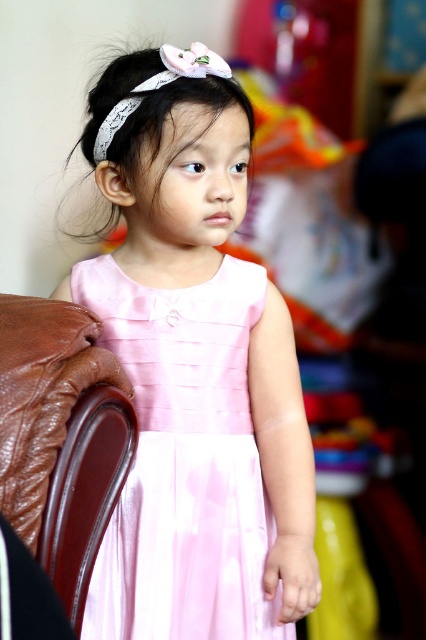
Consider the image. You are a photographer setting up a shoot in this room. You need to position a 1.5 meter tall backdrop stand between the brown leather armchair at left and the white satin headband at upper center. Will the backdrop stand fit vertically between these two objects without touching them?

The brown leather armchair at left is much taller than the white satin headband at upper center. Since the backdrop stand is 1.5 meters tall, it may not fit vertically between them if the armchair is taller than the stand. However, the exact placement depends on their specific heights, which aren

Based on the scene description, which object is wider when viewed from the front? Please choose between the pink satin dress at center and the white lace headband at upper center.

The pink satin dress at center is wider than the white lace headband at upper center.